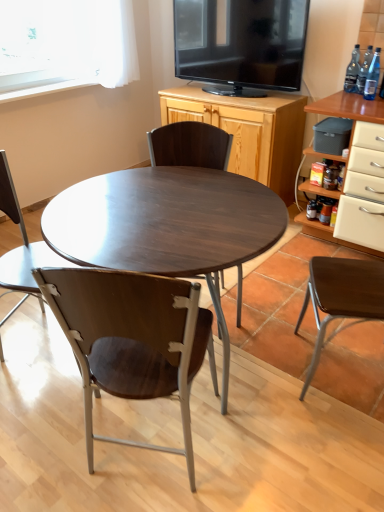
Where is `blank space to the left of wooden chair at center, the 3th chair viewed from the right`? The height and width of the screenshot is (512, 384). blank space to the left of wooden chair at center, the 3th chair viewed from the right is located at coordinates (46, 443).